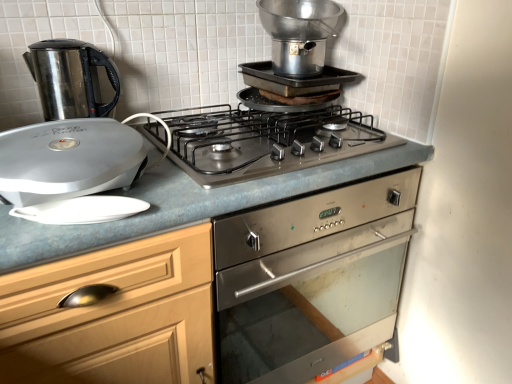
Question: Would you say metallic silver pot at upper center, marked as the third kitchen appliance in a left-to-right arrangement, is a long distance from silver metallic george foreman grill at left, acting as the 2th kitchen appliance starting from the left?

Choices:
 (A) yes
 (B) no

Answer: (B)

Question: From a real-world perspective, is metallic silver pot at upper center, marked as the third kitchen appliance in a left-to-right arrangement, over silver metallic george foreman grill at left, acting as the 2th kitchen appliance starting from the left?

Choices:
 (A) no
 (B) yes

Answer: (B)

Question: From the image's perspective, would you say metallic silver pot at upper center, marked as the third kitchen appliance in a left-to-right arrangement, is shown under silver metallic george foreman grill at left, the 2th kitchen appliance positioned from the right?

Choices:
 (A) yes
 (B) no

Answer: (B)

Question: From the image's perspective, is metallic silver pot at upper center, which appears as the 1th kitchen appliance when viewed from the right, on top of silver metallic george foreman grill at left, the 2th kitchen appliance positioned from the right?

Choices:
 (A) no
 (B) yes

Answer: (B)

Question: Is silver metallic george foreman grill at left, the 2th kitchen appliance positioned from the right, at the back of metallic silver pot at upper center, which appears as the 1th kitchen appliance when viewed from the right?

Choices:
 (A) yes
 (B) no

Answer: (B)

Question: From a real-world perspective, is stainless steel kettle at left, which is counted as the 1th kitchen appliance, starting from the left, positioned above or below blue laminate countertop at center?

Choices:
 (A) above
 (B) below

Answer: (A)

Question: Which is correct: stainless steel kettle at left, acting as the third kitchen appliance starting from the right, is inside blue laminate countertop at center, or outside of it?

Choices:
 (A) outside
 (B) inside

Answer: (A)

Question: From the image's perspective, is stainless steel kettle at left, acting as the third kitchen appliance starting from the right, positioned above or below blue laminate countertop at center?

Choices:
 (A) above
 (B) below

Answer: (A)

Question: Considering the positions of point (64, 46) and point (160, 314), is point (64, 46) closer or farther from the camera than point (160, 314)?

Choices:
 (A) closer
 (B) farther

Answer: (B)

Question: From a real-world perspective, relative to satin silver gas stove at center, is silver metallic george foreman grill at left, acting as the 2th kitchen appliance starting from the left, vertically above or below?

Choices:
 (A) above
 (B) below

Answer: (A)

Question: From the image's perspective, is silver metallic george foreman grill at left, the 2th kitchen appliance positioned from the right, located above or below satin silver gas stove at center?

Choices:
 (A) above
 (B) below

Answer: (B)

Question: Is silver metallic george foreman grill at left, acting as the 2th kitchen appliance starting from the left, bigger or smaller than satin silver gas stove at center?

Choices:
 (A) small
 (B) big

Answer: (A)

Question: Visually, is silver metallic george foreman grill at left, the 2th kitchen appliance positioned from the right, positioned to the left or to the right of satin silver gas stove at center?

Choices:
 (A) right
 (B) left

Answer: (B)

Question: Considering the positions of point [243, 119] and point [313, 39], is point [243, 119] closer or farther from the camera than point [313, 39]?

Choices:
 (A) farther
 (B) closer

Answer: (B)

Question: Considering their positions, is satin silver gas stove at center located in front of or behind metallic silver pot at upper center, marked as the third kitchen appliance in a left-to-right arrangement?

Choices:
 (A) front
 (B) behind

Answer: (A)